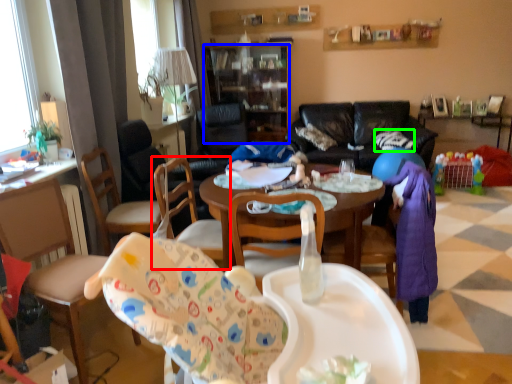
Question: Which object is positioned closest to chair (highlighted by a red box)? Select from cabinetry (highlighted by a blue box) and pillow (highlighted by a green box).

Choices:
 (A) cabinetry
 (B) pillow

Answer: (B)